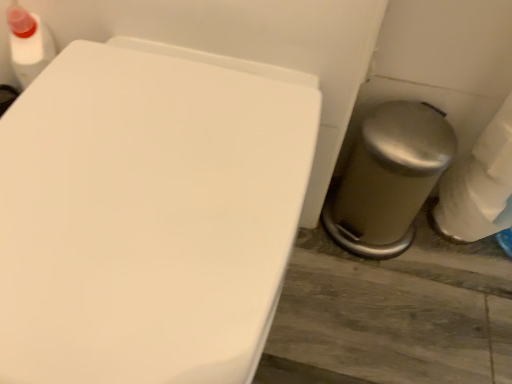
Measure the distance between point [181,75] and camera.

Point [181,75] is 22.17 inches away from camera.

What do you see at coordinates (148, 213) in the screenshot?
I see `white glossy toilet at center` at bounding box center [148, 213].

The image size is (512, 384). I want to click on white glossy toilet at center, so click(x=148, y=213).

Locate an element on the screen. This screenshot has height=384, width=512. satin silver trash can at lower right is located at coordinates (389, 178).

What do you see at coordinates (389, 178) in the screenshot? I see `satin silver trash can at lower right` at bounding box center [389, 178].

Identify the location of white glossy toilet at center. The width and height of the screenshot is (512, 384). (148, 213).

Is satin silver trash can at lower right to the left or to the right of white glossy toilet at center in the image?

In the image, satin silver trash can at lower right appears on the right side of white glossy toilet at center.

Does satin silver trash can at lower right come behind white glossy toilet at center?

Yes, it is.

Which is nearer, (453, 148) or (255, 210)?

The point (255, 210) is more forward.

From the image's perspective, is satin silver trash can at lower right on white glossy toilet at center?

Yes, from the image's perspective, satin silver trash can at lower right is on top of white glossy toilet at center.

Consider the image. From a real-world perspective, which is physically above, satin silver trash can at lower right or white glossy toilet at center?

From a 3D spatial view, white glossy toilet at center is above.

Looking at their sizes, would you say satin silver trash can at lower right is wider or thinner than white glossy toilet at center?

satin silver trash can at lower right is thinner than white glossy toilet at center.

Considering the relative sizes of satin silver trash can at lower right and white glossy toilet at center in the image provided, is satin silver trash can at lower right taller than white glossy toilet at center?

In fact, satin silver trash can at lower right may be shorter than white glossy toilet at center.

In terms of size, does satin silver trash can at lower right appear bigger or smaller than white glossy toilet at center?

satin silver trash can at lower right is smaller than white glossy toilet at center.

Is satin silver trash can at lower right not within white glossy toilet at center?

Indeed, satin silver trash can at lower right is completely outside white glossy toilet at center.

From the picture: Are satin silver trash can at lower right and white glossy toilet at center located far from each other?

They are positioned close to each other.

Could you tell me if satin silver trash can at lower right is facing white glossy toilet at center?

No, satin silver trash can at lower right is not oriented towards white glossy toilet at center.

How many degrees apart are the facing directions of satin silver trash can at lower right and white glossy toilet at center?

There is a 0.744-degree angle between the facing directions of satin silver trash can at lower right and white glossy toilet at center.

Find the location of a particular element. The image size is (512, 384). porcelain lying behind the white glossy toilet at center is located at coordinates (389, 178).

Between white glossy toilet at center and satin silver trash can at lower right, which one appears on the right side from the viewer's perspective?

From the viewer's perspective, satin silver trash can at lower right appears more on the right side.

Relative to satin silver trash can at lower right, is white glossy toilet at center in front or behind?

white glossy toilet at center is positioned closer to the viewer than satin silver trash can at lower right.

Does point (211, 333) lie behind point (365, 226)?

No.

From the image's perspective, is white glossy toilet at center positioned above or below satin silver trash can at lower right?

From the image's perspective, white glossy toilet at center appears below satin silver trash can at lower right.

From a real-world perspective, is white glossy toilet at center positioned over satin silver trash can at lower right based on gravity?

Correct, in the physical world, white glossy toilet at center is higher than satin silver trash can at lower right.

Considering the sizes of objects white glossy toilet at center and satin silver trash can at lower right in the image provided, who is wider, white glossy toilet at center or satin silver trash can at lower right?

Wider between the two is white glossy toilet at center.

Which of these two, white glossy toilet at center or satin silver trash can at lower right, stands taller?

With more height is white glossy toilet at center.

Is white glossy toilet at center smaller than satin silver trash can at lower right?

No, white glossy toilet at center is not smaller than satin silver trash can at lower right.

Is white glossy toilet at center surrounding satin silver trash can at lower right?

No, white glossy toilet at center does not contain satin silver trash can at lower right.

Are white glossy toilet at center and satin silver trash can at lower right far apart?

white glossy toilet at center is actually quite close to satin silver trash can at lower right.

Consider the image. Is white glossy toilet at center turned away from satin silver trash can at lower right?

No, satin silver trash can at lower right is not at the back of white glossy toilet at center.

Can you tell me how much white glossy toilet at center and satin silver trash can at lower right differ in facing direction?

The angle between the facing direction of white glossy toilet at center and the facing direction of satin silver trash can at lower right is 0.744 degrees.

Measure the distance from white glossy toilet at center to satin silver trash can at lower right.

white glossy toilet at center and satin silver trash can at lower right are 14.34 inches apart from each other.

Where is `porcelain located on the right of white glossy toilet at center`? This screenshot has width=512, height=384. porcelain located on the right of white glossy toilet at center is located at coordinates (389, 178).

This screenshot has width=512, height=384. What are the coordinates of `porcelain directly beneath the white glossy toilet at center (from a real-world perspective)` in the screenshot? It's located at (389, 178).

Image resolution: width=512 pixels, height=384 pixels. What are the coordinates of `porcelain above the white glossy toilet at center (from the image's perspective)` in the screenshot? It's located at (389, 178).